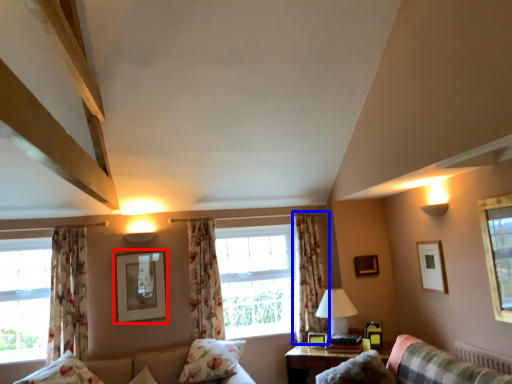
Question: Which object appears closest to the camera in this image, picture frame (highlighted by a red box) or curtain (highlighted by a blue box)?

Choices:
 (A) picture frame
 (B) curtain

Answer: (A)